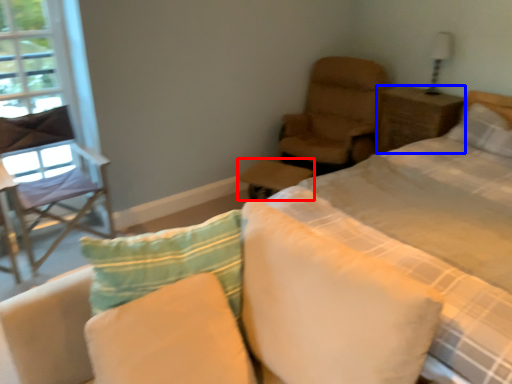
Question: Which object is further to the camera taking this photo, table (highlighted by a red box) or nightstand (highlighted by a blue box)?

Choices:
 (A) table
 (B) nightstand

Answer: (B)